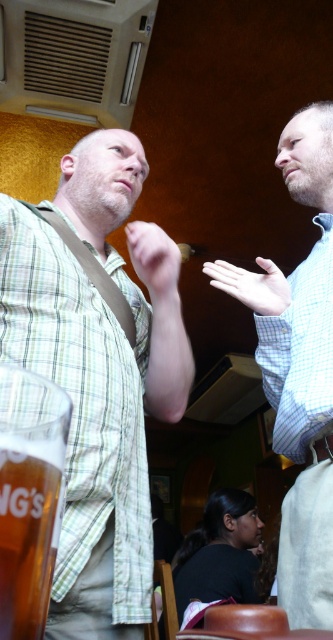
You are a photographer standing in a casual dining establishment. You want to take a photo of the blue checkered shirt at upper right. The camera you are holding is 37.45 inches away from the shirt. Is the distance sufficient to capture the entire shirt in the photo?

The blue checkered shirt at upper right and the camera are 37.45 inches apart, so the distance is sufficient to capture the entire shirt in the photo.

You are a photographer standing in the corner of the dining area. You want to take a photo of both the green plaid shirt at center and the blue checkered shirt at upper right without any obstructions. Which person should you position closer to the camera to ensure both are visible clearly?

The green plaid shirt at center is in front of the blue checkered shirt at upper right, so you should position the person wearing the green plaid shirt at center closer to the camera to avoid blocking the view of the blue checkered shirt at upper right.

You are a customer sitting at the table and want to wave to the man in the green plaid shirt at center. Which direction should you look to find him relative to the man in the blue checkered shirt at upper right?

The green plaid shirt at center is to the left of the blue checkered shirt at upper right, so you should look to the left side relative to the blue checkered shirt at upper right to find the man in the green plaid shirt at center.